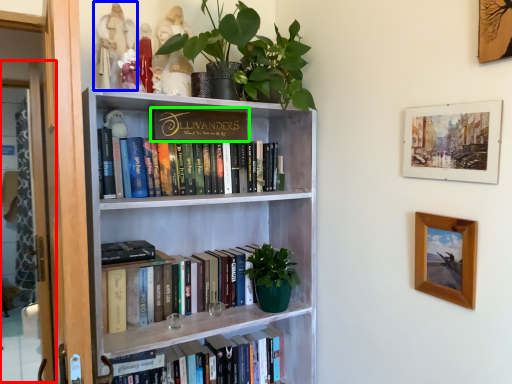
Question: Which object is the closest to the glass door (highlighted by a red box)? Choose among these: toy (highlighted by a blue box) or book (highlighted by a green box).

Choices:
 (A) toy
 (B) book

Answer: (A)